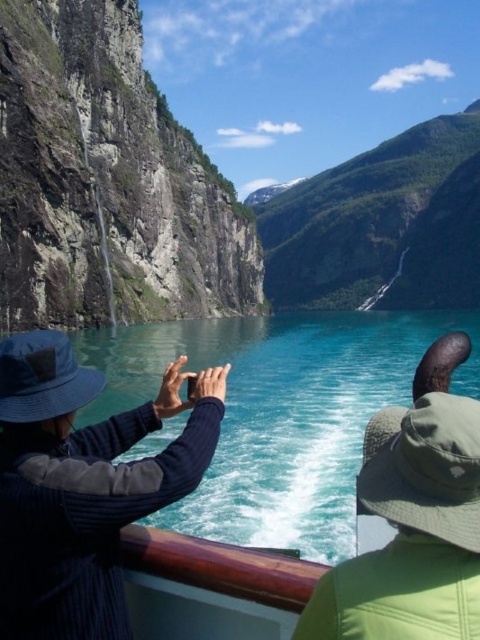
Question: Which object appears farthest from the camera in this image?

Choices:
 (A) wooden boat at center
 (B) blue fabric hat at left
 (C) rugged stone cliff at left

Answer: (C)

Question: Observing the image, what is the correct spatial positioning of wooden boat at center in reference to green fabric hat at upper right?

Choices:
 (A) above
 (B) below

Answer: (A)

Question: Which is nearer to the wooden boat at center?

Choices:
 (A) rugged stone cliff at left
 (B) green fabric hat at upper right
 (C) blue fabric hat at left

Answer: (C)

Question: Can you confirm if blue fabric hat at left is positioned to the right of green fabric hat at upper right?

Choices:
 (A) no
 (B) yes

Answer: (A)

Question: Where is wooden boat at center located in relation to green fabric hat at upper right in the image?

Choices:
 (A) left
 (B) right

Answer: (A)

Question: Which point appears farthest from the camera in this image?

Choices:
 (A) 381,556
 (B) 68,276

Answer: (B)